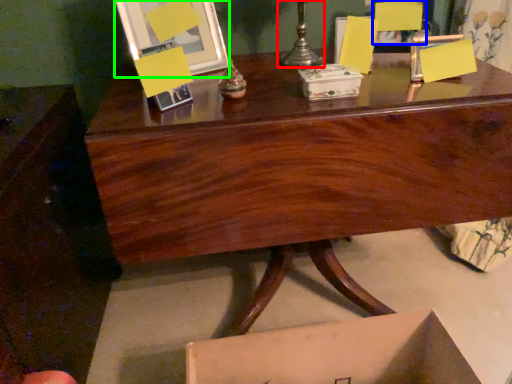
Question: Which object is positioned closest to candle holder (highlighted by a red box)? Select from armchair (highlighted by a blue box) and picture frame (highlighted by a green box).

Choices:
 (A) armchair
 (B) picture frame

Answer: (A)